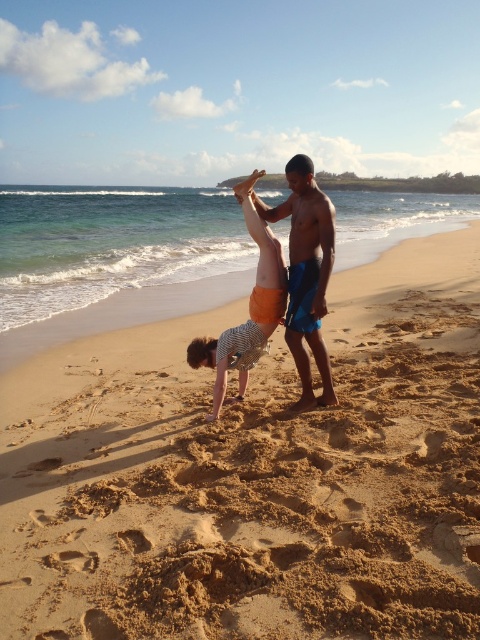
Question: Is sandy yellow sand at center thinner than striped cotton shirt at center?

Choices:
 (A) yes
 (B) no

Answer: (B)

Question: Is sandy yellow sand at center to the left of orange shorts at center from the viewer's perspective?

Choices:
 (A) yes
 (B) no

Answer: (A)

Question: Which object appears closest to the camera in this image?

Choices:
 (A) orange shorts at center
 (B) striped cotton shirt at center
 (C) sandy yellow sand at center

Answer: (C)

Question: Is sandy yellow sand at center thinner than striped cotton shirt at center?

Choices:
 (A) yes
 (B) no

Answer: (B)

Question: Which object appears farthest from the camera in this image?

Choices:
 (A) sandy yellow sand at center
 (B) striped cotton shirt at center
 (C) orange shorts at center

Answer: (B)

Question: Which object is closer to the camera taking this photo?

Choices:
 (A) striped cotton shirt at center
 (B) sandy yellow sand at center
 (C) orange shorts at center

Answer: (B)